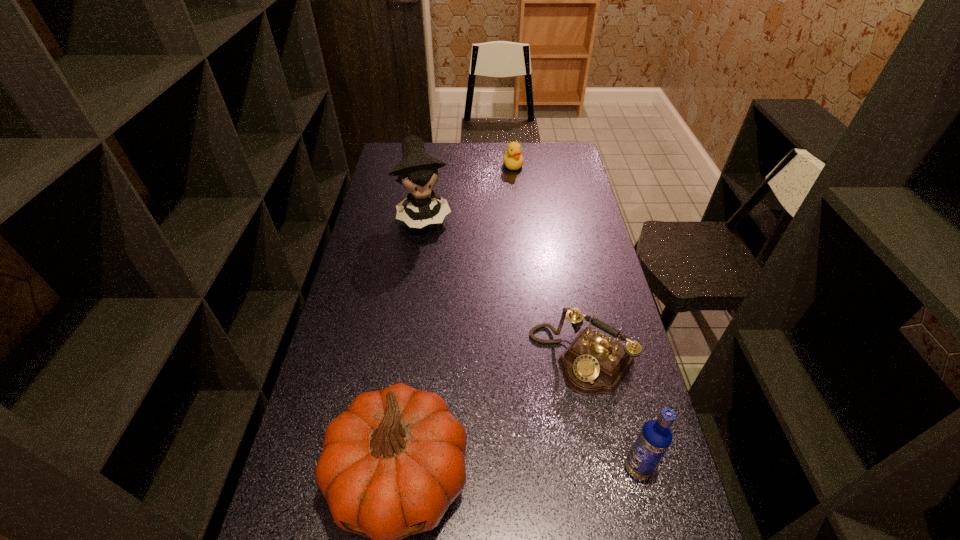
The height and width of the screenshot is (540, 960). In order to click on vacant spot on the desktop that is between the pumpkin and the vodka and is positioned at the face of the fourth nearest object in this screenshot , I will do `click(521, 473)`.

Where is `vacant spot on the desktop that is between the pumpkin and the vodka and is positioned on the dial of the third farthest object`? This screenshot has width=960, height=540. vacant spot on the desktop that is between the pumpkin and the vodka and is positioned on the dial of the third farthest object is located at coordinates (493, 474).

Where is `free space on the desktop that is between the pumpkin and the vodka and is positioned on the face of the farthest object`? free space on the desktop that is between the pumpkin and the vodka and is positioned on the face of the farthest object is located at coordinates (547, 472).